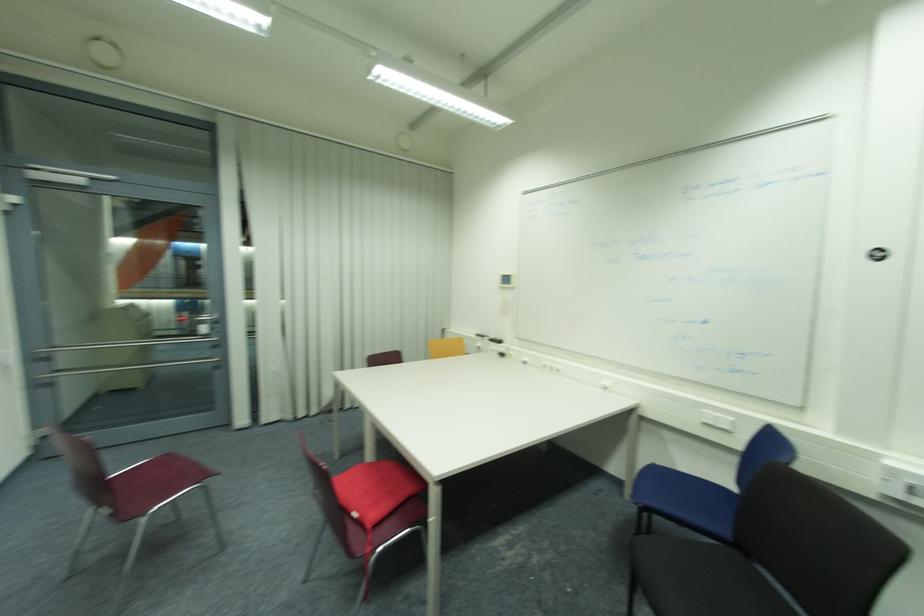
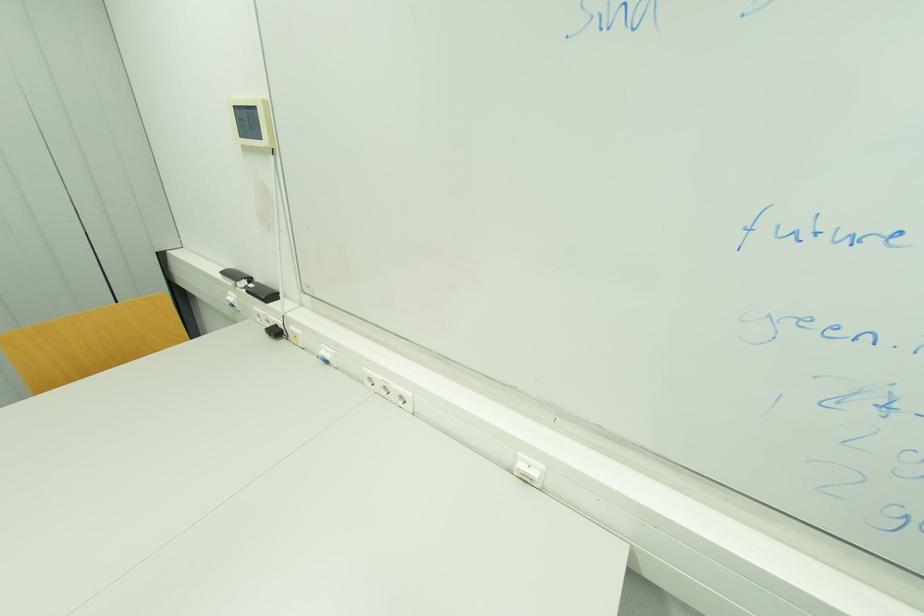
Locate, in the second image, the point that corresponds to point (529, 363) in the first image.

(330, 362)